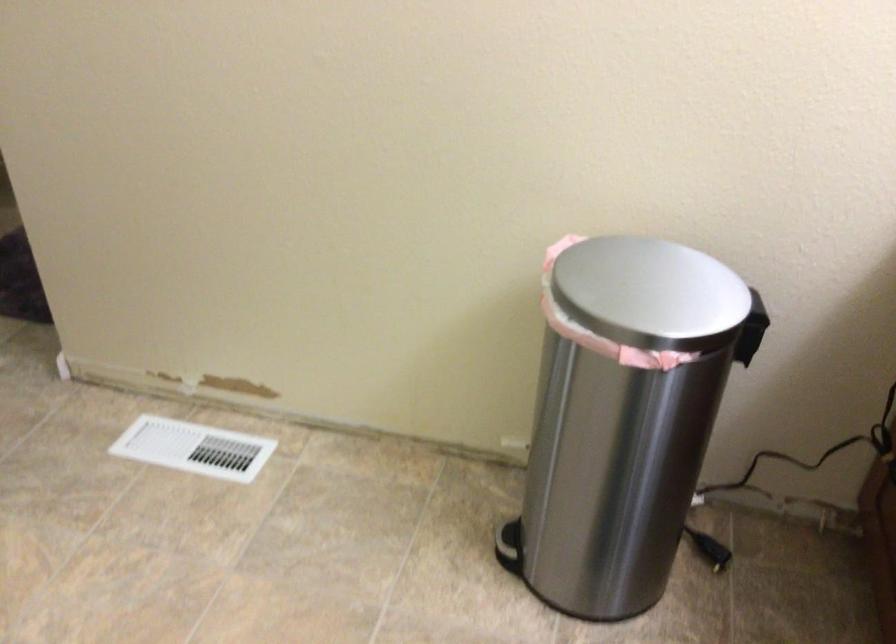
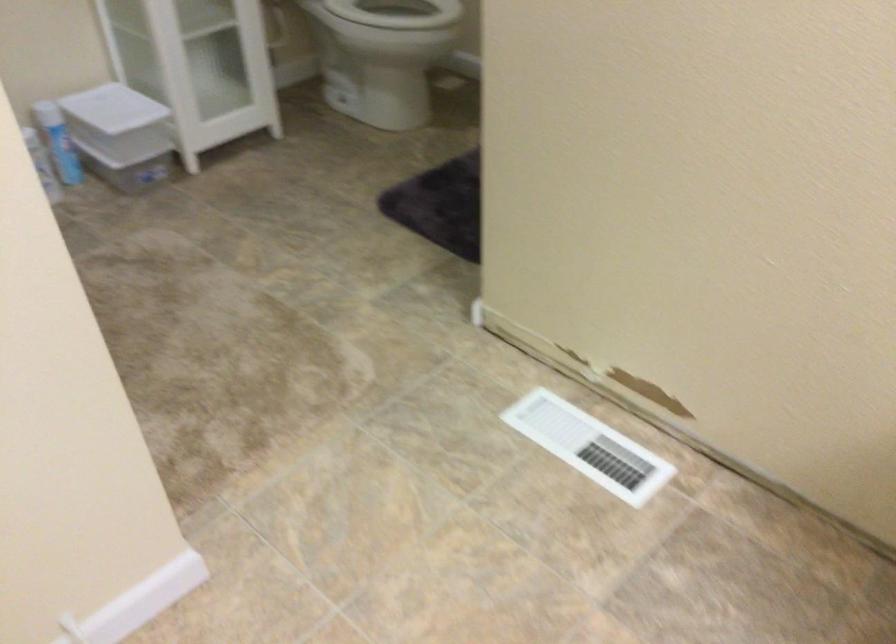
What movement of the cameraman would produce the second image?

The cameraman walked toward left, forward.